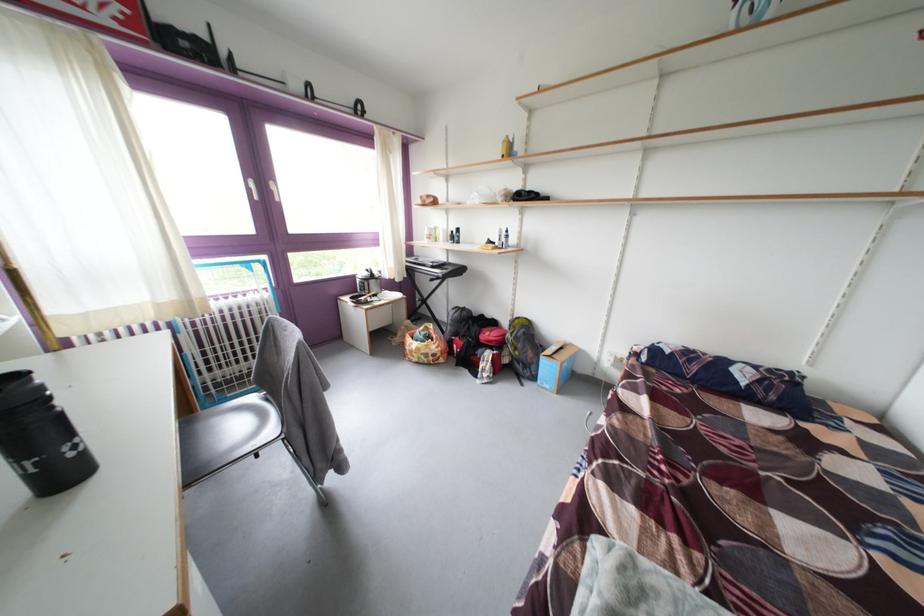
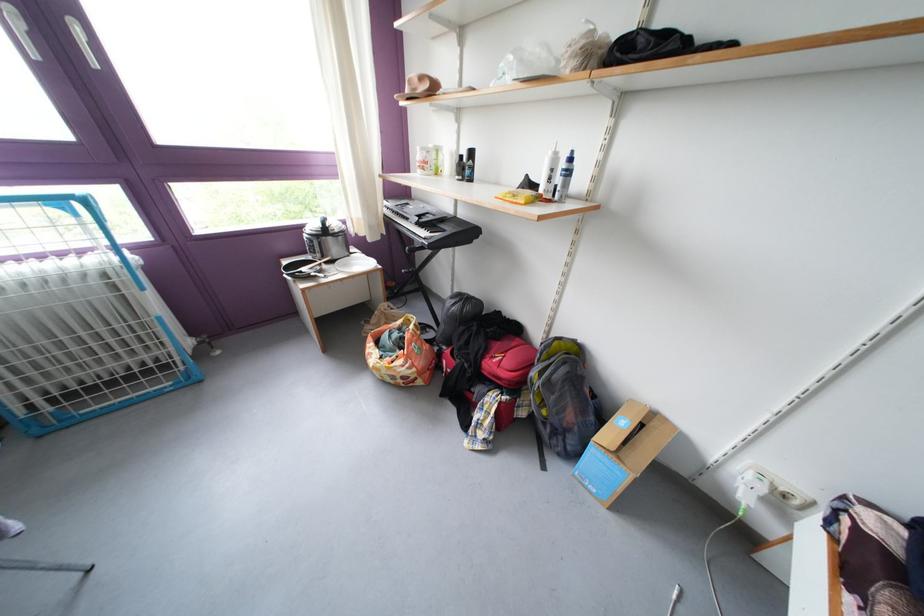
In the second image, find the point that corresponds to pixel 515 238 in the first image.

(573, 169)